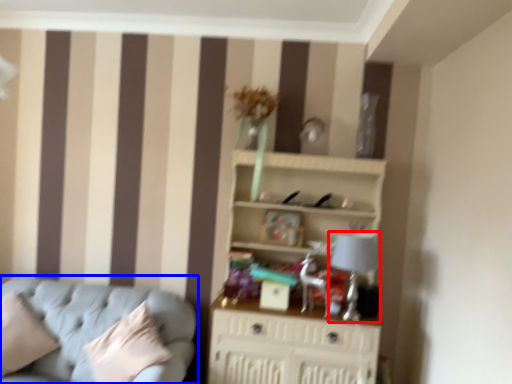
Question: Which object appears closest to the camera in this image, table lamp (highlighted by a red box) or studio couch (highlighted by a blue box)?

Choices:
 (A) table lamp
 (B) studio couch

Answer: (B)